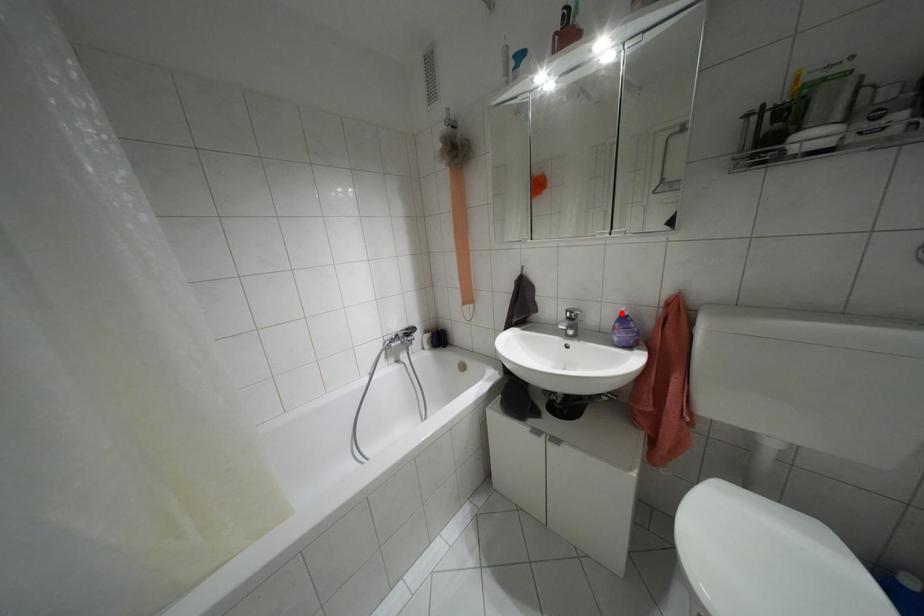
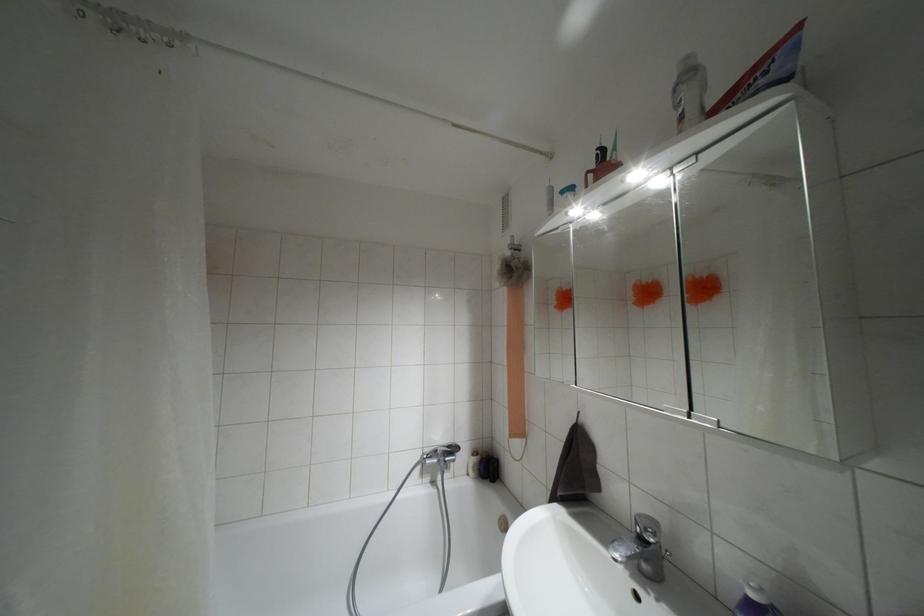
In the second image, find the point that corresponds to the highlighted location in the first image.

(751, 594)